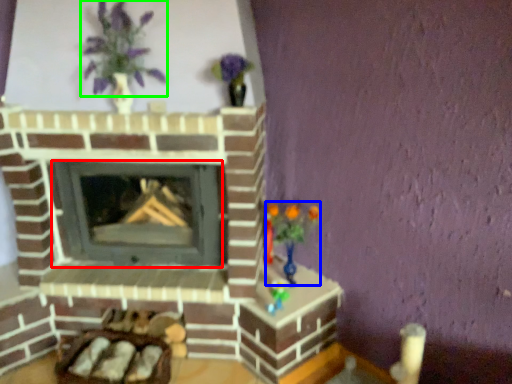
Question: Which object is positioned farthest from wood burning stove (highlighted by a red box)? Select from toy (highlighted by a blue box) and floral arrangement (highlighted by a green box).

Choices:
 (A) toy
 (B) floral arrangement

Answer: (B)